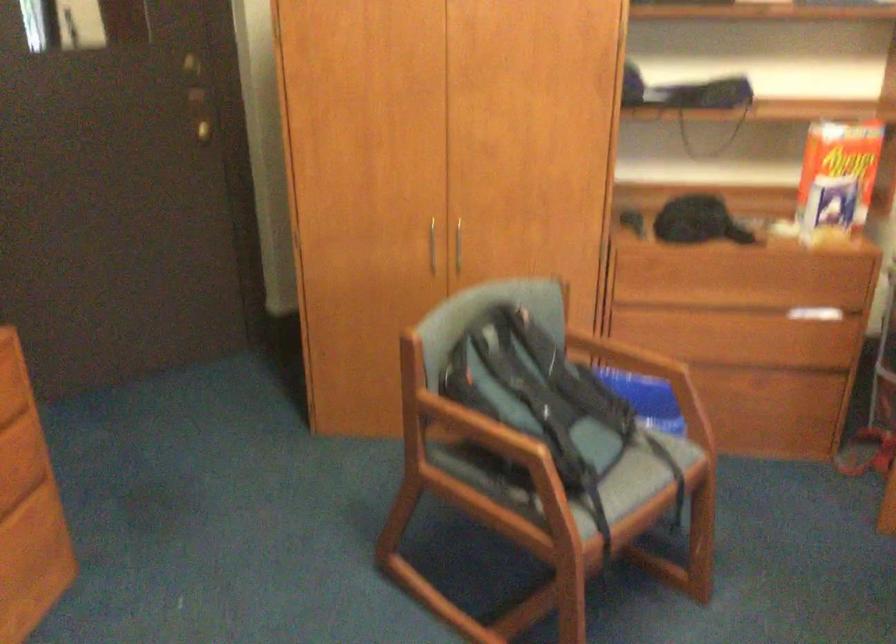
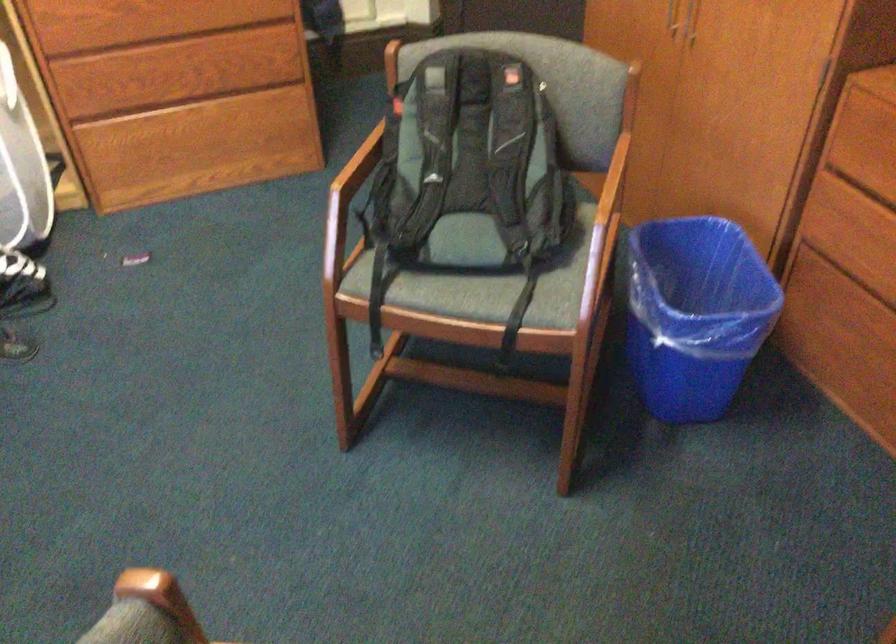
Question: I am providing you with two images of the same scene from different viewpoints. After the viewpoint changes to image2, which objects are now occluded?

Choices:
 (A) black backpack handle
 (B) blue trash can
 (C) wooden chair armrest
 (D) none of these

Answer: (D)